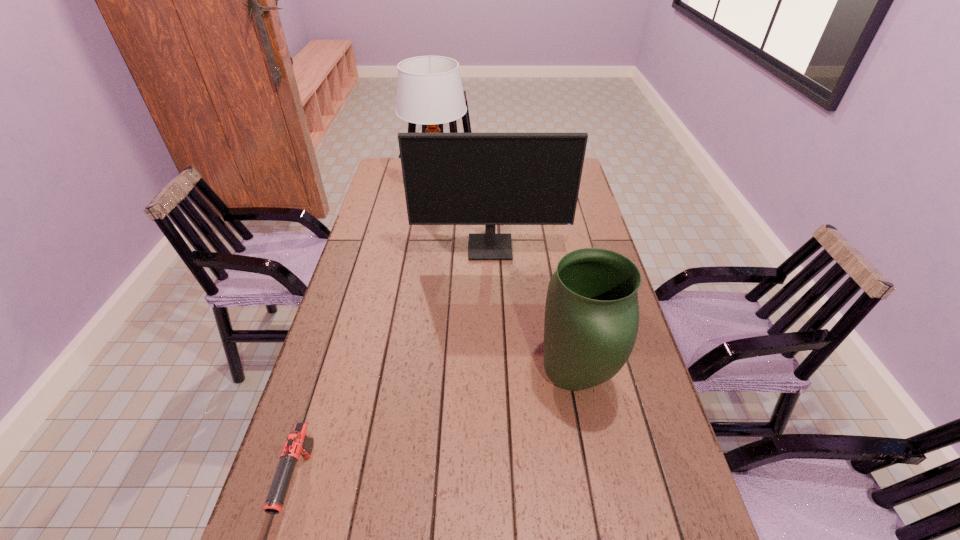
The width and height of the screenshot is (960, 540). Find the location of `free spot between the second shortest object and the leftmost object`. free spot between the second shortest object and the leftmost object is located at coordinates (437, 430).

Locate an element on the screen. The image size is (960, 540). vacant point located between the third farthest object and the third nearest object is located at coordinates (533, 313).

Find the location of a particular element. This screenshot has height=540, width=960. free space between the vase and the leftmost object is located at coordinates (437, 430).

Identify which object is located as the nearest to the shortest object. Please provide its 2D coordinates. Your answer should be formatted as a tuple, i.e. [(x, y)], where the tuple contains the x and y coordinates of a point satisfying the conditions above.

[(591, 322)]

You are a GUI agent. You are given a task and a screenshot of the screen. Output one action in this format:
    pyautogui.click(x=<x>, y=<y>)
    Task: Click on the third closest object to the gun
    The height and width of the screenshot is (540, 960).
    Given the screenshot: What is the action you would take?
    pyautogui.click(x=429, y=90)

Locate an element on the screen. The height and width of the screenshot is (540, 960). free space in the image that satisfies the following two spatial constraints: 1. on the front-facing side of the third nearest object; 2. on the left side of the vase is located at coordinates (493, 378).